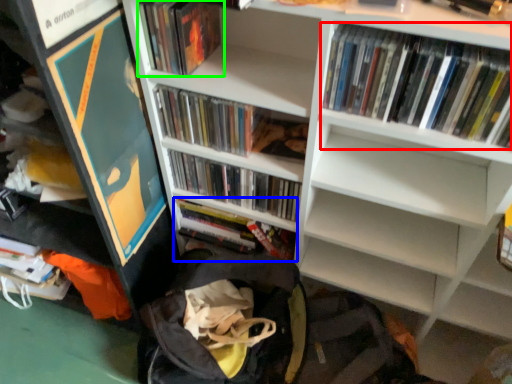
Question: Based on their relative distances, which object is nearer to book (highlighted by a red box)? Choose from book (highlighted by a blue box) and book (highlighted by a green box).

Choices:
 (A) book
 (B) book

Answer: (B)